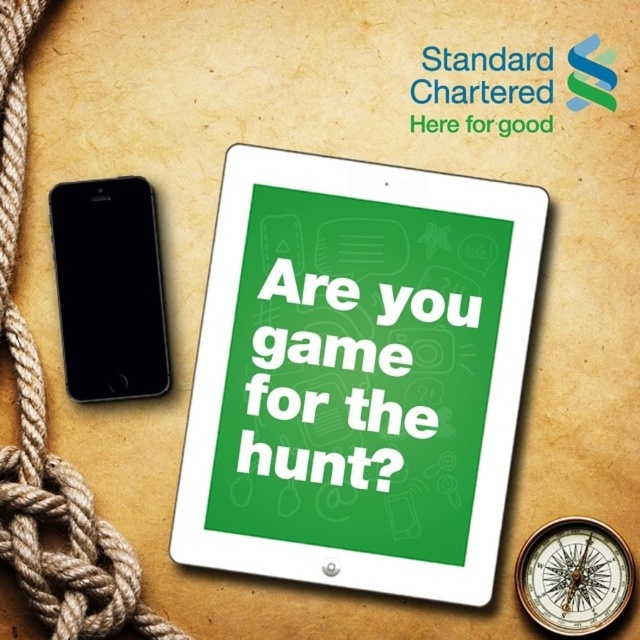
You are a customer service representative at Standard Chartered Bank. You need to place a promotional material on the desk. The desk has a green glossy tablet at center and a brown rope at left. Where should you place the new promotional material so it is visible to customers approaching from the left side of the desk?

Place the new promotional material above the brown rope at left so it is visible to customers approaching from the left side of the desk.

You are a graphic designer working on a layout for a promotional ad. You need to place a black smartphone to the left of the green glossy tablet at center. According to the provided scene description, where should you position the smartphone?

The green glossy tablet at center is located at point [358,372]. To place the black smartphone to the left of it, position the smartphone to the left of the green glossy tablet at center.